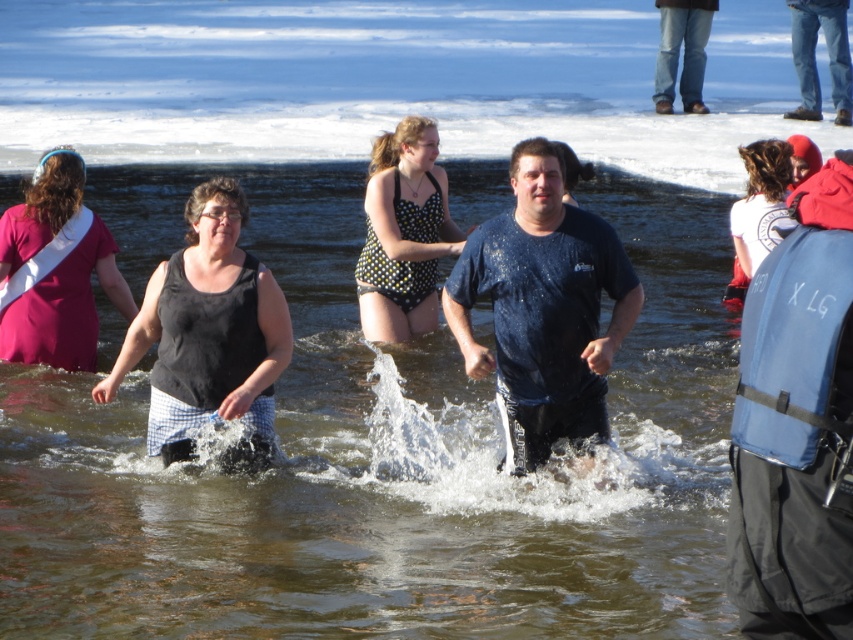
Question: Which point appears closest to the camera in this image?

Choices:
 (A) (368, 284)
 (B) (618, 433)
 (C) (204, 368)
 (D) (836, 186)

Answer: (D)

Question: Does dark blue t-shirt at center have a lesser width compared to black matte tank top at center?

Choices:
 (A) no
 (B) yes

Answer: (B)

Question: Among these objects, which one is nearest to the camera?

Choices:
 (A) white cotton shirt at upper right
 (B) black dotted swimsuit at center
 (C) red fleece life jacket at upper right

Answer: (C)

Question: Observing the image, what is the correct spatial positioning of dark blue t-shirt at center in reference to blue fabric life jacket at right?

Choices:
 (A) left
 (B) right

Answer: (A)

Question: Does clear water at center lie in front of red fleece life jacket at upper right?

Choices:
 (A) yes
 (B) no

Answer: (B)

Question: Which point is closer to the camera?

Choices:
 (A) black dotted swimsuit at center
 (B) white cotton shirt at upper right
 (C) black matte tank top at center
 (D) clear water at center

Answer: (D)